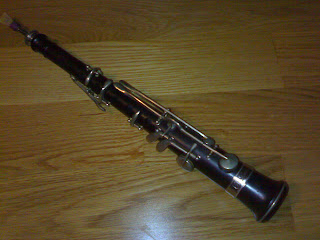
This screenshot has height=240, width=320. What are the coordinates of `wood pattern` in the screenshot? It's located at (115, 155).